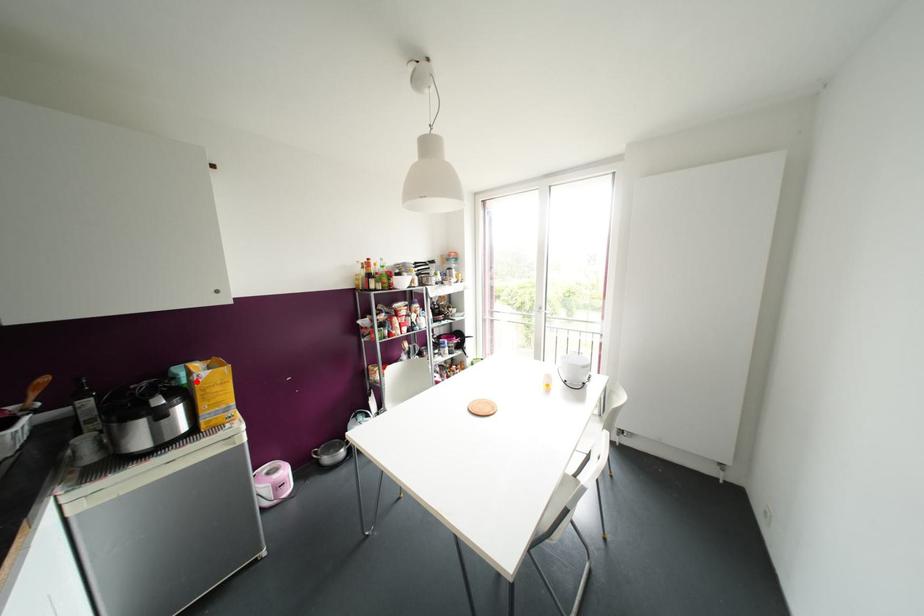
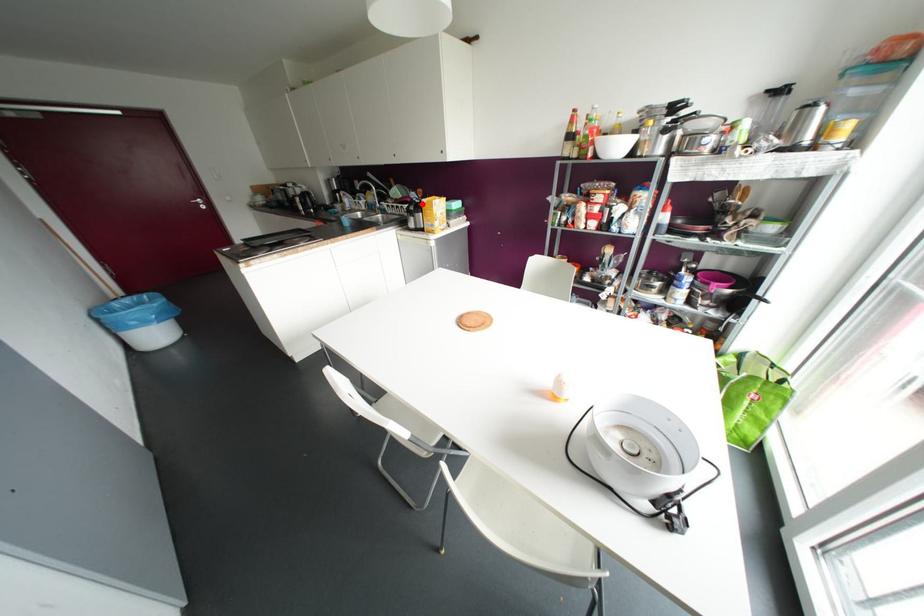
I am providing you with two images of the same scene from different viewpoints. A red point is marked on the first image and another point is marked on the second image. Are the points marked in image1 and image2 representing the same 3D position?

Yes